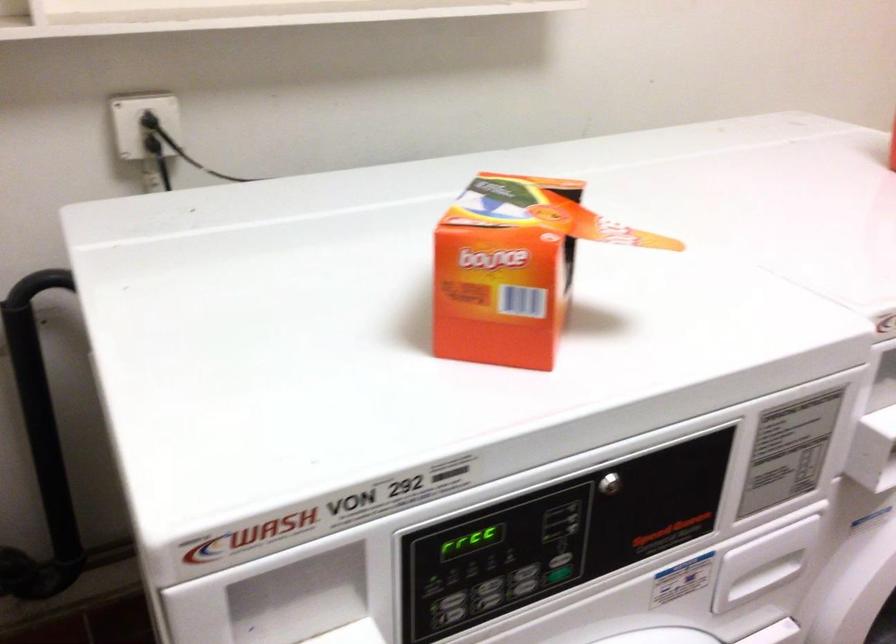
Where is `silver key lock`? This screenshot has width=896, height=644. silver key lock is located at coordinates (609, 484).